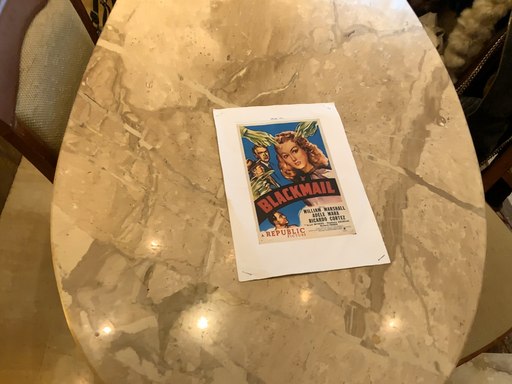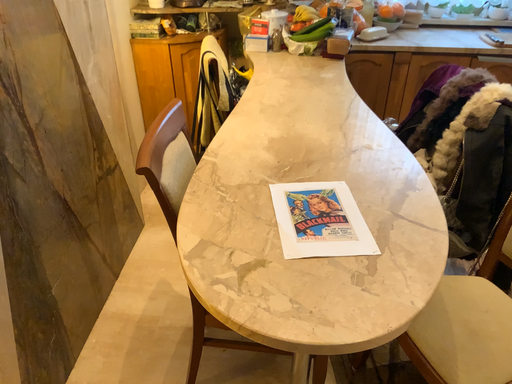
Question: Which way did the camera rotate in the video?

Choices:
 (A) rotated right
 (B) rotated left

Answer: (B)